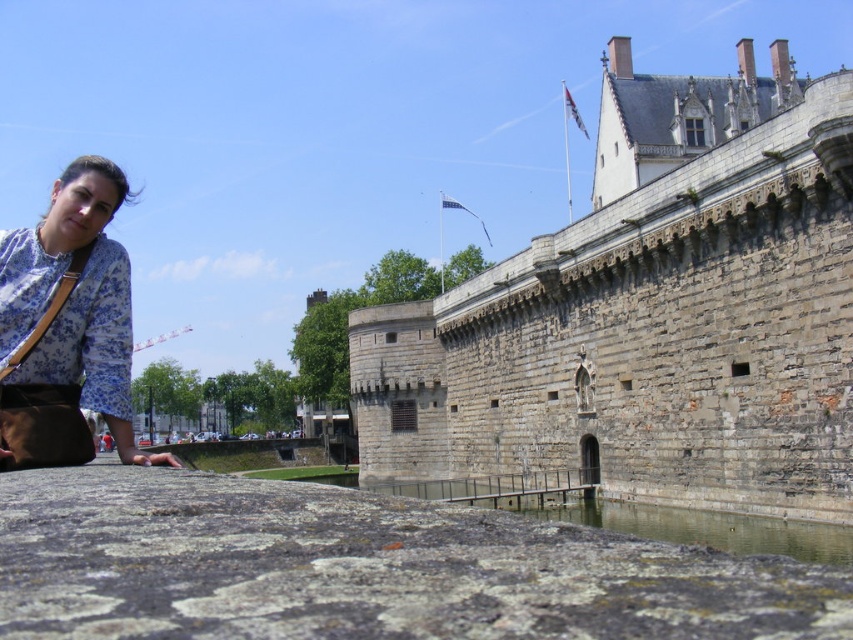
Measure the distance from gray stone castle at upper center to floral fabric blouse at lower left.

gray stone castle at upper center is 59.97 meters away from floral fabric blouse at lower left.

Is gray stone castle at upper center shorter than floral fabric blouse at lower left?

No.

Describe the element at coordinates (650, 314) in the screenshot. This screenshot has width=853, height=640. I see `gray stone castle at upper center` at that location.

Locate an element on the screen. This screenshot has width=853, height=640. gray stone castle at upper center is located at coordinates (650, 314).